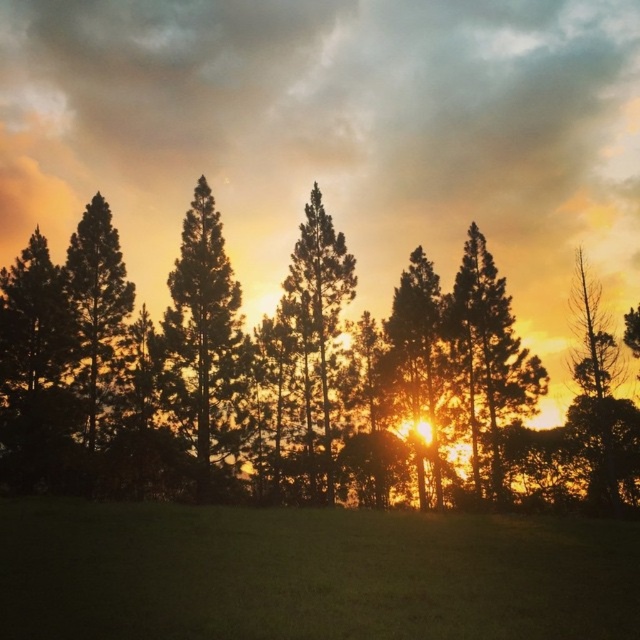
Question: Does silhouette pine tree at center have a smaller size compared to golden textured tree at center?

Choices:
 (A) no
 (B) yes

Answer: (A)

Question: Does green grassy field at lower center appear under silhouette pine tree at left?

Choices:
 (A) no
 (B) yes

Answer: (B)

Question: Is silhouette pine tree at center closer to camera compared to silhouette pine tree at left?

Choices:
 (A) no
 (B) yes

Answer: (B)

Question: Which of the following is the closest to the observer?

Choices:
 (A) (413, 356)
 (B) (189, 234)
 (C) (209, 630)
 (D) (580, 260)

Answer: (C)

Question: Estimate the real-world distances between objects in this image. Which object is farther from the silhouette pine tree at left?

Choices:
 (A) silhouette wood tree at center
 (B) silhouette pine at center
 (C) silhouette trees at center

Answer: (B)

Question: Which object is closer to the camera taking this photo?

Choices:
 (A) silhouette pine tree at left
 (B) silhouette trees at center

Answer: (B)